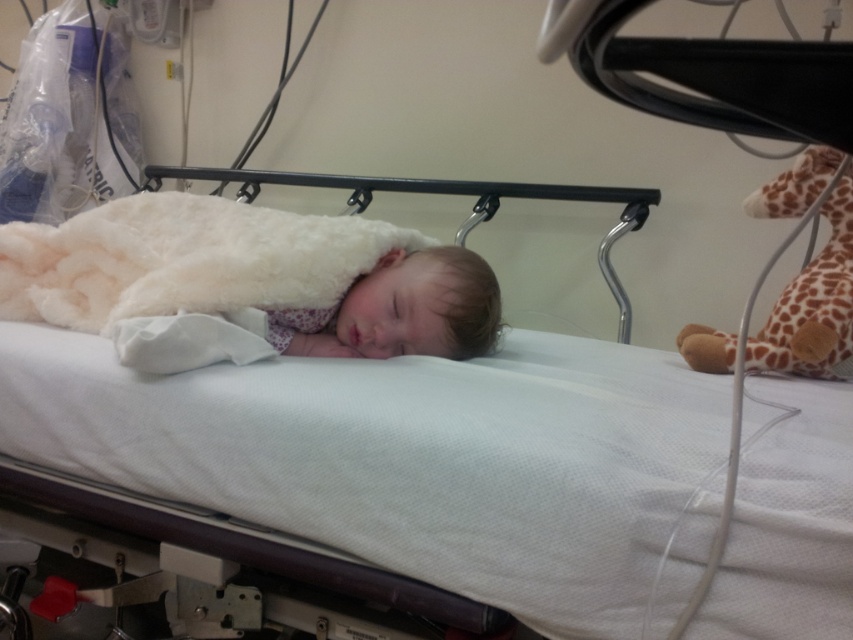
You are a nurse in a hospital. You need to place a small medical kit between the white fabric infant bed at center and the white fluffy blanket at center. The medical kit is 10 inches long. Can you fit it between them without moving either object?

The distance between the white fabric infant bed at center and the white fluffy blanket at center is 10.60 inches. Since the medical kit is 10 inches long, it can fit between them as there is enough space.

You are a nurse in a hospital. You need to place a small medical kit between the white fabric infant bed at center and the red emergency button at the foot of the bed. The medical kit is 24 inches long. Can you fit it between them?

The distance between the white fabric infant bed at center and the red emergency button at the foot of the bed is 23.96 inches. Since the medical kit is 24 inches long, it is slightly too long to fit between them.

You are a nurse in a hospital. You need to locate the point at coordinates (418,461). Where is this point located in the scene?

The point at coordinates (418,461) is located on the white fabric infant bed at center.